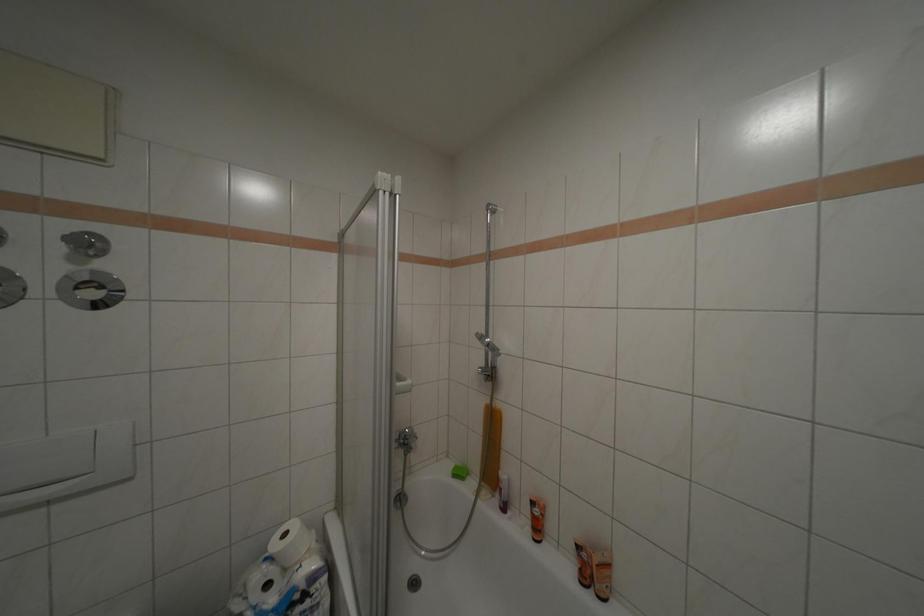
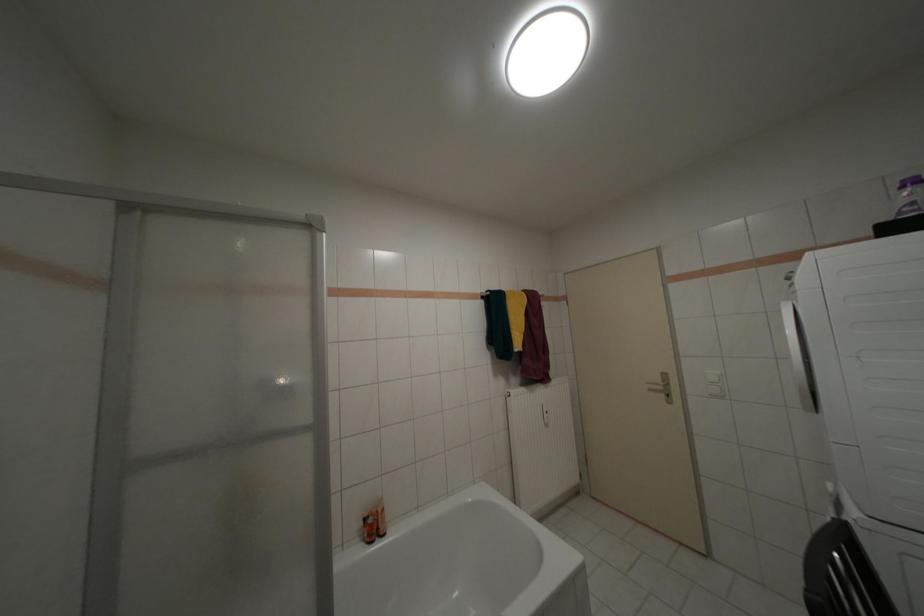
Question: How did the camera likely rotate?

Choices:
 (A) Left
 (B) Right
 (C) Up
 (D) Down

Answer: (B)